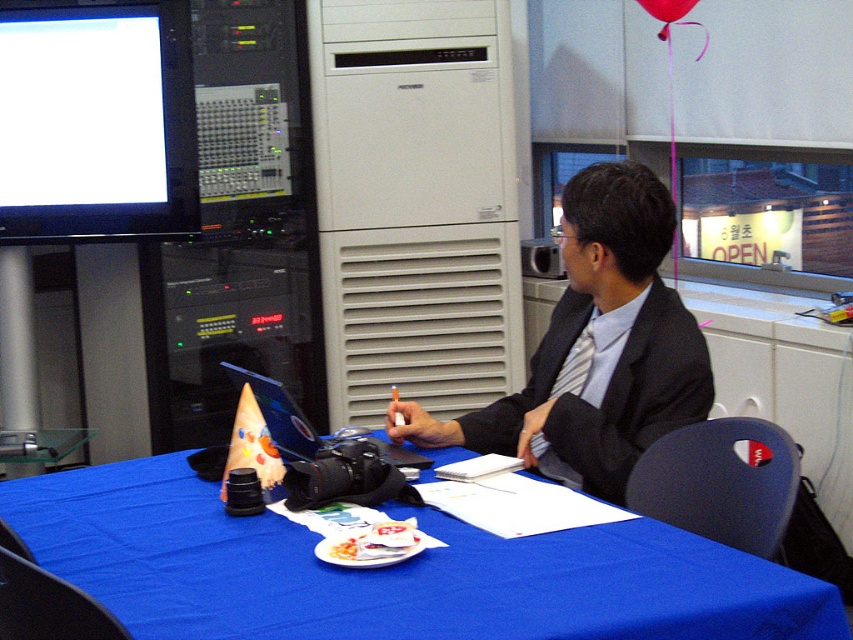
Question: Among these objects, which one is farthest from the camera?

Choices:
 (A) blue fabric tablecloth at center
 (B) blue plastic laptop at center

Answer: (B)

Question: Does blue plastic laptop at center appear on the right side of red fabric balloon at upper center?

Choices:
 (A) no
 (B) yes

Answer: (A)

Question: Can you confirm if blue fabric tablecloth at center is thinner than matte black suit at center?

Choices:
 (A) yes
 (B) no

Answer: (B)

Question: Which point appears farthest from the camera in this image?

Choices:
 (A) (708, 630)
 (B) (271, 428)
 (C) (653, 8)

Answer: (C)

Question: Which point is farther to the camera?

Choices:
 (A) matte black suit at center
 (B) blue plastic laptop at center
 (C) blue fabric tablecloth at center

Answer: (A)

Question: Is blue fabric tablecloth at center to the right of blue plastic laptop at center from the viewer's perspective?

Choices:
 (A) no
 (B) yes

Answer: (B)